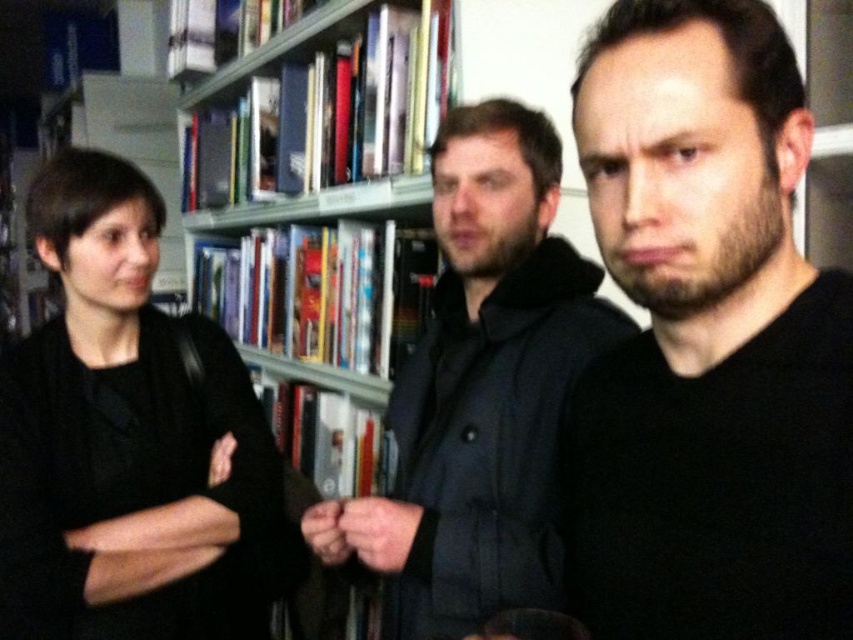
Question: Can you confirm if black matte jacket at left is positioned above matte black coat at center?

Choices:
 (A) no
 (B) yes

Answer: (A)

Question: Which point is closer to the camera?

Choices:
 (A) (637, 577)
 (B) (450, 218)
 (C) (265, 320)
 (D) (59, 216)

Answer: (A)

Question: Which point is closer to the camera taking this photo?

Choices:
 (A) (279, 323)
 (B) (128, 252)
 (C) (746, 269)

Answer: (C)

Question: Which point appears closest to the camera in this image?

Choices:
 (A) (738, 541)
 (B) (216, 205)

Answer: (A)

Question: Can you confirm if black matte jacket at left is positioned to the left of metallic gray bookshelf at upper center?

Choices:
 (A) no
 (B) yes

Answer: (B)

Question: In this image, where is matte black coat at center located relative to metallic gray bookshelf at upper center?

Choices:
 (A) left
 (B) right

Answer: (B)